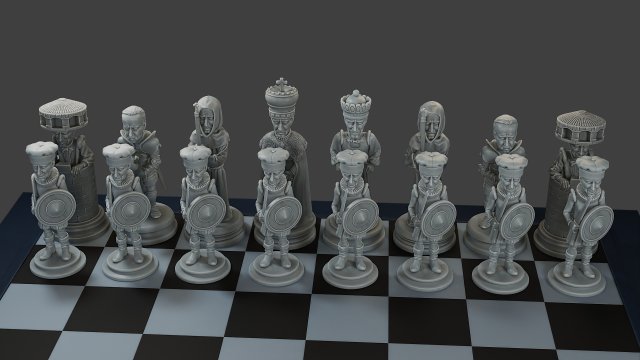
Where is `base stand`? base stand is located at coordinates 57,264, 125,265, 198,271, 273,273, 349,278, 436,280, 506,282, 582,285.